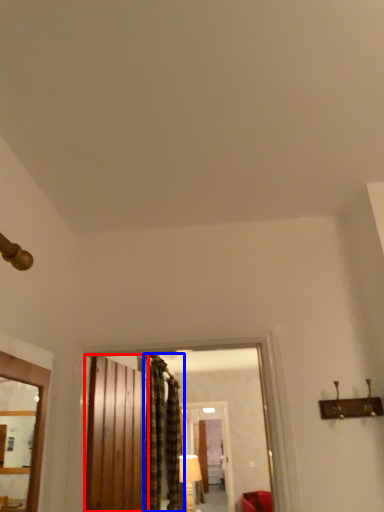
Question: Which object is closer to the camera taking this photo, barn door (highlighted by a red box) or curtain (highlighted by a blue box)?

Choices:
 (A) barn door
 (B) curtain

Answer: (A)